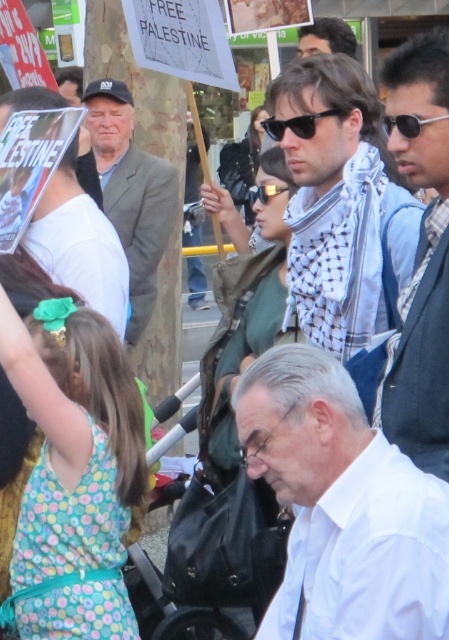
You are a photographer trying to capture a clear shot of the white checkered scarf at center and the black plastic sunglasses at upper center. Since you want to focus on the larger object, which one should you zoom in on?

The white checkered scarf at center has a larger size compared to the black plastic sunglasses at upper center, so you should zoom in on the white checkered scarf at center.

In the scene of the protest, there are two people wearing the dark gray fabric vest at upper right and the light blue shirt at upper center. From the perspective of an observer facing the scene, which one is positioned to the left?

The dark gray fabric vest at upper right is to the left of the light blue shirt at upper center.